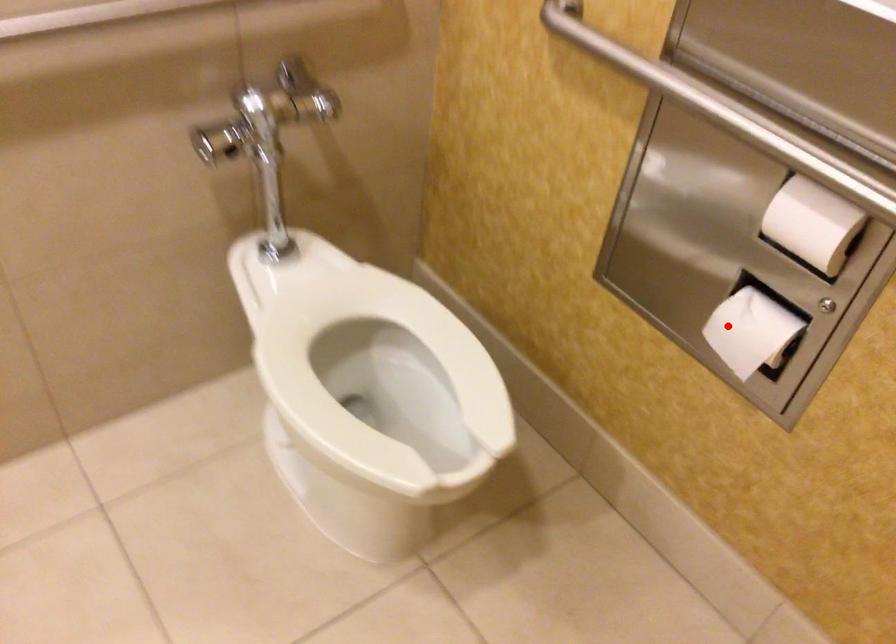
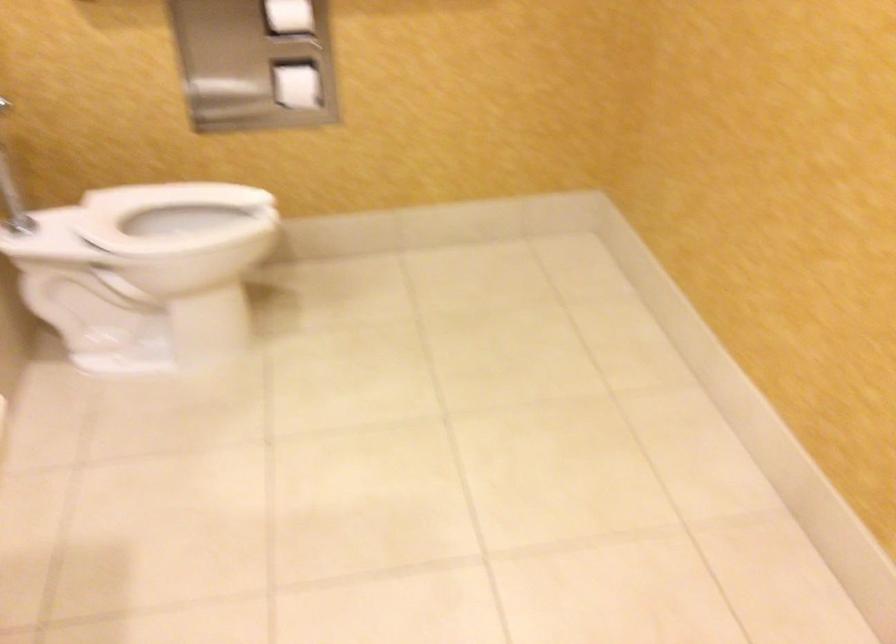
Question: I am providing you with two images of the same scene from different viewpoints. Given a red point in image1, look at the same physical point in image2. Is it:

Choices:
 (A) Closer to the viewpoint
 (B) Farther from the viewpoint

Answer: (B)